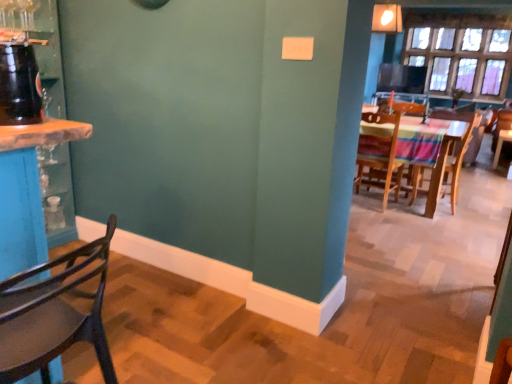
Question: Considering the relative sizes of wooden chair at right, positioned as the 2th chair in front-to-back order, and wooden chair at left, which appears as the 1th chair when viewed from the front, in the image provided, is wooden chair at right, positioned as the 2th chair in front-to-back order, thinner than wooden chair at left, which appears as the 1th chair when viewed from the front,?

Choices:
 (A) no
 (B) yes

Answer: (B)

Question: From a real-world perspective, is wooden chair at right, positioned as the 2th chair in front-to-back order, physically below wooden chair at left, arranged as the 4th chair when viewed from the right?

Choices:
 (A) no
 (B) yes

Answer: (B)

Question: Is wooden chair at right, which is the second chair in left-to-right order, to the left of wooden chair at left, arranged as the 4th chair when viewed from the right, from the viewer's perspective?

Choices:
 (A) no
 (B) yes

Answer: (A)

Question: Is wooden chair at right, positioned as the 2th chair in front-to-back order, in front of wooden chair at left, which appears as the 1th chair when viewed from the front?

Choices:
 (A) yes
 (B) no

Answer: (B)

Question: Would you say wooden chair at left, which is the fourth chair from back to front, is part of wooden chair at right, which ranks as the 3th chair in back-to-front order,'s contents?

Choices:
 (A) yes
 (B) no

Answer: (B)

Question: Considering the relative positions of wooden chair at right, which ranks as the 3th chair in back-to-front order, and wooden chair at left, which is the fourth chair from back to front, in the image provided, is wooden chair at right, which ranks as the 3th chair in back-to-front order, behind wooden chair at left, which is the fourth chair from back to front,?

Choices:
 (A) no
 (B) yes

Answer: (B)

Question: Is wooden chair at center, the third chair positioned from the left, wider than clear glass window at upper right?

Choices:
 (A) yes
 (B) no

Answer: (A)

Question: Is wooden chair at center, the third chair when ordered from front to back, further to camera compared to clear glass window at upper right?

Choices:
 (A) no
 (B) yes

Answer: (A)

Question: From the image's perspective, does wooden chair at center, the third chair positioned from the left, appear higher than clear glass window at upper right?

Choices:
 (A) yes
 (B) no

Answer: (B)

Question: Is wooden chair at center, the second chair from the back, at the left side of clear glass window at upper right?

Choices:
 (A) no
 (B) yes

Answer: (B)

Question: Is wooden chair at center, the third chair when ordered from front to back, to the right of clear glass window at upper right from the viewer's perspective?

Choices:
 (A) yes
 (B) no

Answer: (B)

Question: Can clear glass window at upper right be found inside wooden chair at center, the third chair positioned from the left?

Choices:
 (A) yes
 (B) no

Answer: (B)

Question: Is wooden chair at center, which is counted as the second chair, starting from the right, with wooden chair at left, which is the fourth chair from back to front?

Choices:
 (A) yes
 (B) no

Answer: (B)